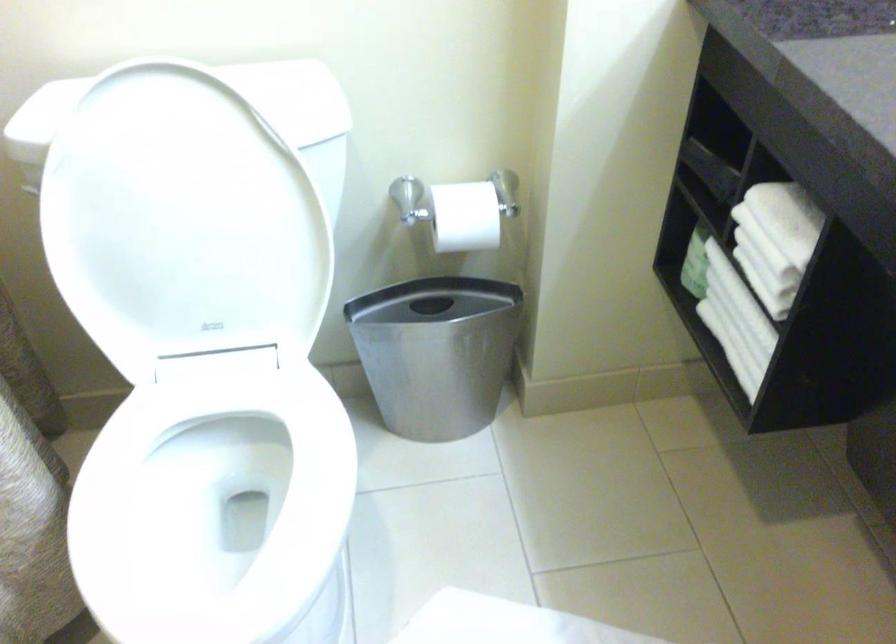
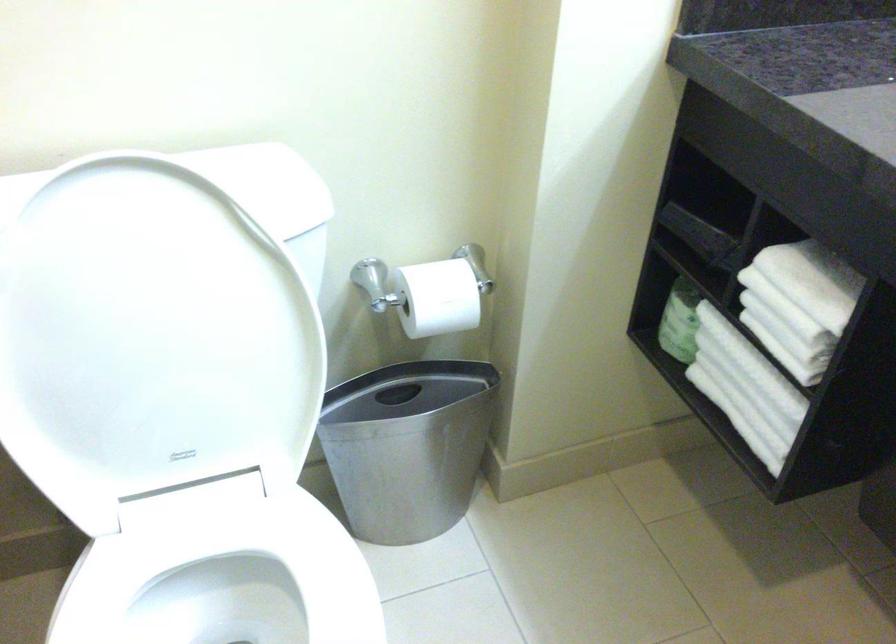
Where in the second image is the point corresponding to point 460,214 from the first image?

(436, 298)